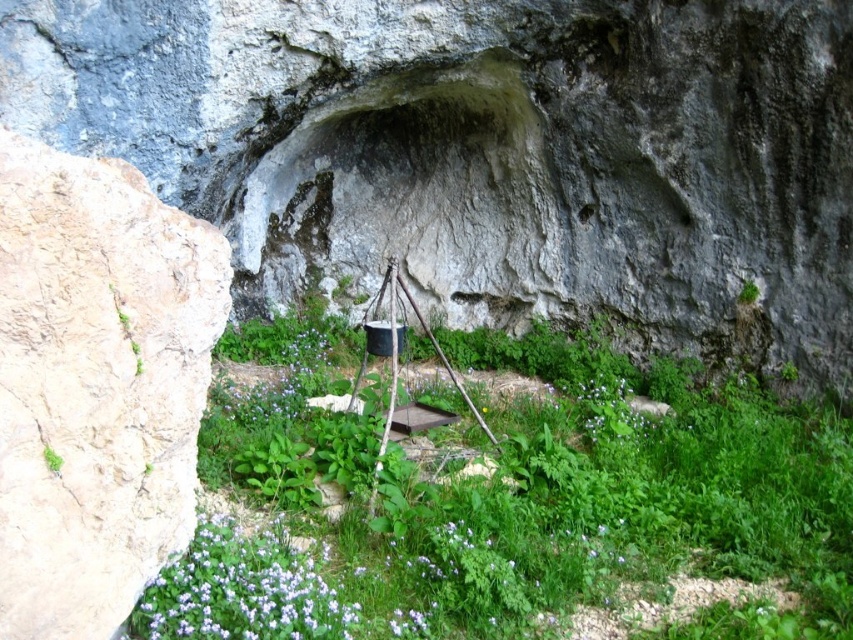
From the picture: Does beige rough rock at left have a greater width compared to purple matte flower at center?

In fact, beige rough rock at left might be narrower than purple matte flower at center.

Does beige rough rock at left have a larger size compared to purple matte flower at center?

Actually, beige rough rock at left might be smaller than purple matte flower at center.

The image size is (853, 640). What do you see at coordinates (96, 385) in the screenshot?
I see `beige rough rock at left` at bounding box center [96, 385].

Where is `beige rough rock at left`? beige rough rock at left is located at coordinates (96, 385).

Can you confirm if green leafy grass at center is wider than purple matte flower at center?

Yes, green leafy grass at center is wider than purple matte flower at center.

Measure the distance from green leafy grass at center to purple matte flower at center.

green leafy grass at center and purple matte flower at center are 20.34 inches apart from each other.

I want to click on green leafy grass at center, so click(556, 497).

The height and width of the screenshot is (640, 853). Find the location of `green leafy grass at center`. green leafy grass at center is located at coordinates 556,497.

Based on the photo, measure the distance between point [173,342] and camera.

Point [173,342] is 3.97 feet from camera.

Does point (86, 625) come in front of point (601, 422)?

Yes, point (86, 625) is in front of point (601, 422).

Is point (73, 458) farther from viewer compared to point (656, 413)?

No, (73, 458) is in front of (656, 413).

Identify the location of beige rough rock at left. (96, 385).